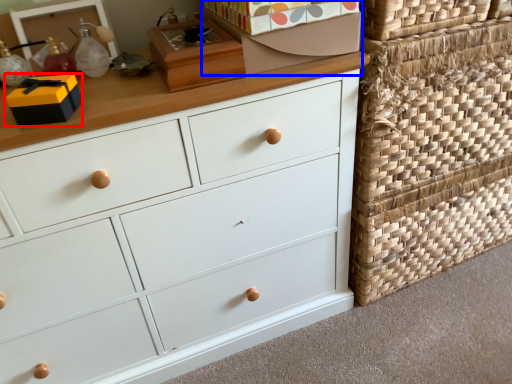
Question: Which of the following is the closest to the observer, storage box (highlighted by a red box) or shoe box (highlighted by a blue box)?

Choices:
 (A) storage box
 (B) shoe box

Answer: (A)